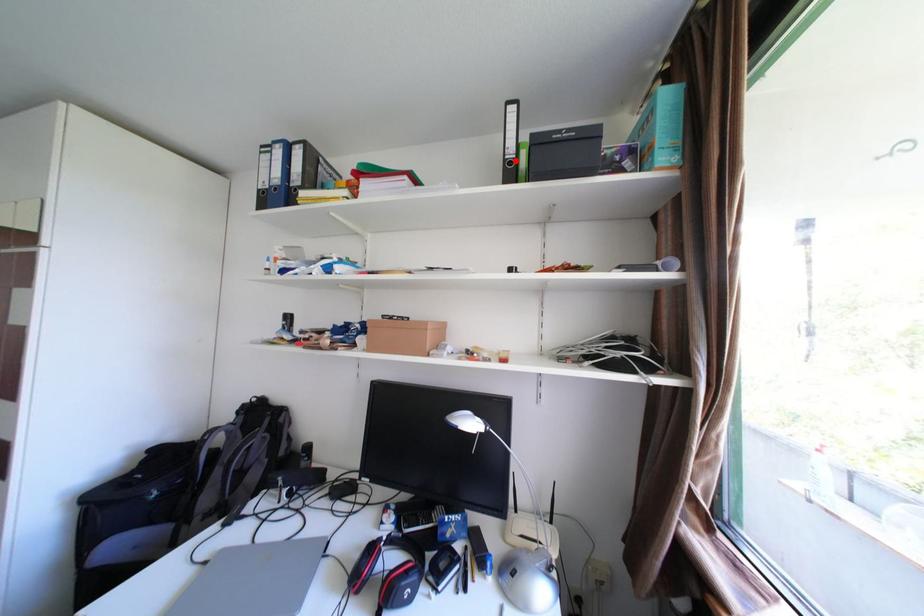
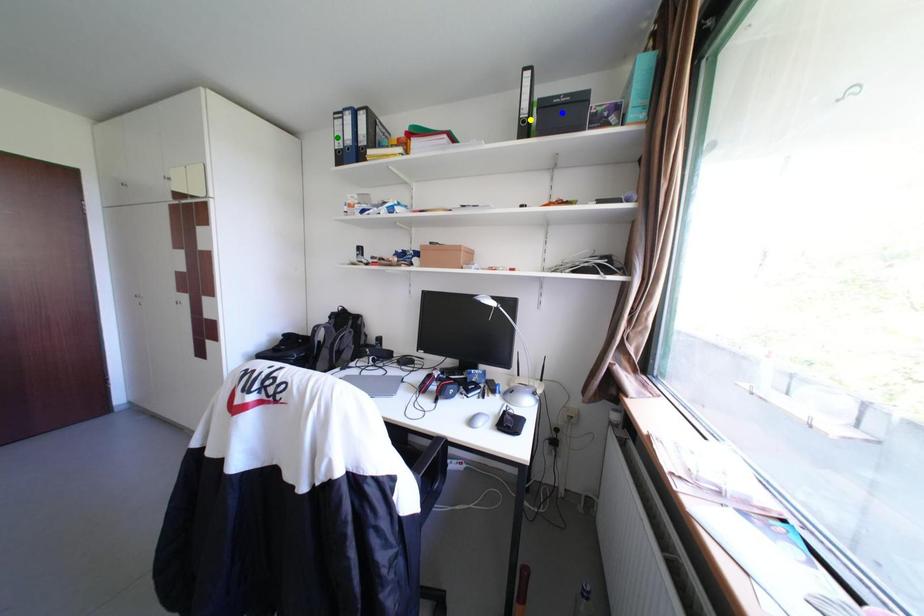
Question: I am providing you with two images of the same scene from different viewpoints. A red point is marked on the first image. You are given multiple points on the second image. In image 2, which mark is for the same physical point as the one in image 1?

Choices:
 (A) green point
 (B) blue point
 (C) yellow point

Answer: (C)